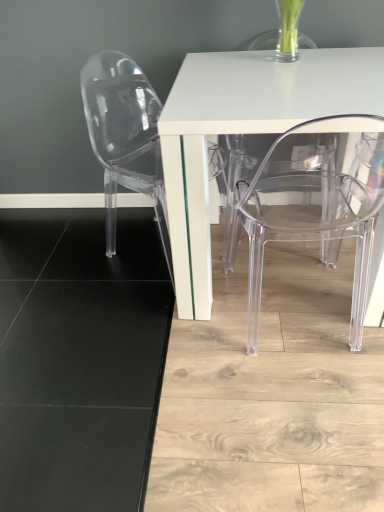
The height and width of the screenshot is (512, 384). Describe the element at coordinates (314, 203) in the screenshot. I see `transparent acrylic chair at lower right, which is the 2th chair in left-to-right order` at that location.

Where is `transparent plastic chair at left, arranged as the second chair when viewed from the right`? The image size is (384, 512). transparent plastic chair at left, arranged as the second chair when viewed from the right is located at coordinates (125, 137).

At what (x,y) coordinates should I click in order to perform the action: click on white glossy table at center. Please return your answer as a coordinate pair (x, y). The width and height of the screenshot is (384, 512). Looking at the image, I should click on (245, 132).

The image size is (384, 512). In order to click on transparent acrylic chair at lower right, the first chair when ordered from right to left in this screenshot , I will do `click(314, 203)`.

Which is behind, white glossy table at center or transparent plastic chair at left, arranged as the second chair when viewed from the right?

transparent plastic chair at left, arranged as the second chair when viewed from the right, is further from the camera.

Is white glossy table at center thinner than transparent plastic chair at left, arranged as the second chair when viewed from the right?

No, white glossy table at center is not thinner than transparent plastic chair at left, arranged as the second chair when viewed from the right.

Is white glossy table at center outside of transparent plastic chair at left, the first chair from the left?

Yes.

Would you say white glossy table at center is a long distance from transparent plastic chair at left, arranged as the second chair when viewed from the right?

No, white glossy table at center is not far from transparent plastic chair at left, arranged as the second chair when viewed from the right.

Considering the sizes of transparent plastic chair at left, the first chair from the left, and white glossy table at center in the image, is transparent plastic chair at left, the first chair from the left, taller or shorter than white glossy table at center?

transparent plastic chair at left, the first chair from the left, is taller than white glossy table at center.

From a real-world perspective, relative to white glossy table at center, is transparent plastic chair at left, arranged as the second chair when viewed from the right, vertically above or below?

transparent plastic chair at left, arranged as the second chair when viewed from the right, is above white glossy table at center.

Is transparent plastic chair at left, the first chair from the left, completely or partially outside of white glossy table at center?

Absolutely, transparent plastic chair at left, the first chair from the left, is external to white glossy table at center.

From the image's perspective, is transparent plastic chair at left, arranged as the second chair when viewed from the right, positioned above or below white glossy table at center?

Clearly, from the image's perspective, transparent plastic chair at left, arranged as the second chair when viewed from the right, is above white glossy table at center.

From a real-world perspective, is transparent plastic chair at left, the first chair from the left, located higher than transparent acrylic chair at lower right, the first chair when ordered from right to left?

Incorrect, from a real-world perspective, transparent plastic chair at left, the first chair from the left, is lower than transparent acrylic chair at lower right, the first chair when ordered from right to left.

Locate an element on the screen. chair below the transparent acrylic chair at lower right, which is the 2th chair in left-to-right order (from a real-world perspective) is located at coordinates (125, 137).

Is transparent acrylic chair at lower right, the first chair when ordered from right to left, outside of transparent plastic chair at left, arranged as the second chair when viewed from the right?

That's correct, transparent acrylic chair at lower right, the first chair when ordered from right to left, is outside of transparent plastic chair at left, arranged as the second chair when viewed from the right.

From the picture: Who is bigger, transparent acrylic chair at lower right, the first chair when ordered from right to left, or transparent plastic chair at left, arranged as the second chair when viewed from the right?

transparent plastic chair at left, arranged as the second chair when viewed from the right, is bigger.

Is transparent acrylic chair at lower right, which is the 2th chair in left-to-right order, taller than transparent plastic chair at left, the first chair from the left?

Correct, transparent acrylic chair at lower right, which is the 2th chair in left-to-right order, is much taller as transparent plastic chair at left, the first chair from the left.

In terms of width, does transparent acrylic chair at lower right, the first chair when ordered from right to left, look wider or thinner when compared to transparent plastic chair at left, arranged as the second chair when viewed from the right?

transparent acrylic chair at lower right, the first chair when ordered from right to left, is thinner than transparent plastic chair at left, arranged as the second chair when viewed from the right.

What's the angular difference between white glossy table at center and transparent acrylic chair at lower right, which is the 2th chair in left-to-right order,'s facing directions?

The angle between the facing direction of white glossy table at center and the facing direction of transparent acrylic chair at lower right, which is the 2th chair in left-to-right order, is 175 degrees.

Is white glossy table at center inside the boundaries of transparent acrylic chair at lower right, the first chair when ordered from right to left, or outside?

white glossy table at center is located beyond the bounds of transparent acrylic chair at lower right, the first chair when ordered from right to left.

Which object is positioned more to the right, white glossy table at center or transparent acrylic chair at lower right, which is the 2th chair in left-to-right order?

white glossy table at center.

Where is `table above the transparent acrylic chair at lower right, which is the 2th chair in left-to-right order (from the image's perspective)`? The height and width of the screenshot is (512, 384). table above the transparent acrylic chair at lower right, which is the 2th chair in left-to-right order (from the image's perspective) is located at coordinates (245, 132).

Who is bigger, transparent acrylic chair at lower right, the first chair when ordered from right to left, or white glossy table at center?

white glossy table at center is bigger.

In terms of height, does transparent acrylic chair at lower right, which is the 2th chair in left-to-right order, look taller or shorter compared to white glossy table at center?

In the image, transparent acrylic chair at lower right, which is the 2th chair in left-to-right order, appears to be taller than white glossy table at center.

Considering the positions of objects transparent acrylic chair at lower right, which is the 2th chair in left-to-right order, and white glossy table at center in the image provided, who is more to the right, transparent acrylic chair at lower right, which is the 2th chair in left-to-right order, or white glossy table at center?

From the viewer's perspective, white glossy table at center appears more on the right side.

Is point (330, 117) more distant than point (178, 228)?

No, it is in front of (178, 228).

This screenshot has height=512, width=384. Identify the location of table on the right of transparent plastic chair at left, the first chair from the left. (245, 132).

At what (x,y) coordinates should I click in order to perform the action: click on table below the transparent plastic chair at left, the first chair from the left (from the image's perspective). Please return your answer as a coordinate pair (x, y). The width and height of the screenshot is (384, 512). Looking at the image, I should click on (245, 132).

Considering their positions, is transparent plastic chair at left, arranged as the second chair when viewed from the right, positioned further to transparent acrylic chair at lower right, the first chair when ordered from right to left, than white glossy table at center?

transparent plastic chair at left, arranged as the second chair when viewed from the right, is positioned further to the anchor transparent acrylic chair at lower right, the first chair when ordered from right to left.

Which object lies further to the anchor point transparent plastic chair at left, arranged as the second chair when viewed from the right, white glossy table at center or transparent acrylic chair at lower right, which is the 2th chair in left-to-right order?

Among the two, transparent acrylic chair at lower right, which is the 2th chair in left-to-right order, is located further to transparent plastic chair at left, arranged as the second chair when viewed from the right.

Estimate the real-world distances between objects in this image. Which object is closer to transparent acrylic chair at lower right, which is the 2th chair in left-to-right order, white glossy table at center or transparent plastic chair at left, arranged as the second chair when viewed from the right?

white glossy table at center is closer to transparent acrylic chair at lower right, which is the 2th chair in left-to-right order.

Estimate the real-world distances between objects in this image. Which object is further from white glossy table at center, transparent acrylic chair at lower right, which is the 2th chair in left-to-right order, or transparent plastic chair at left, the first chair from the left?

transparent plastic chair at left, the first chair from the left, is further to white glossy table at center.

Considering their positions, is transparent acrylic chair at lower right, the first chair when ordered from right to left, positioned closer to transparent plastic chair at left, the first chair from the left, than white glossy table at center?

Based on the image, white glossy table at center appears to be nearer to transparent plastic chair at left, the first chair from the left.

Which object lies further to the anchor point white glossy table at center, transparent plastic chair at left, the first chair from the left, or transparent acrylic chair at lower right, which is the 2th chair in left-to-right order?

transparent plastic chair at left, the first chair from the left, lies further to white glossy table at center than the other object.

Identify the location of chair between transparent plastic chair at left, arranged as the second chair when viewed from the right, and white glossy table at center from left to right. This screenshot has width=384, height=512. (314, 203).